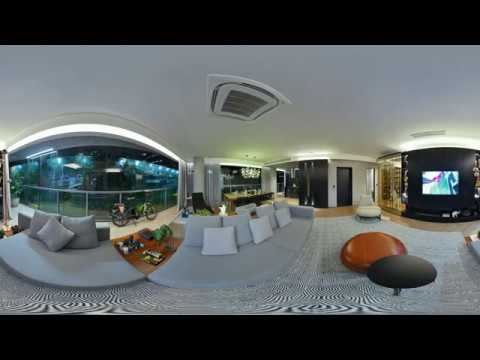
What are the coordinates of `door` in the screenshot? It's located at (338, 173).